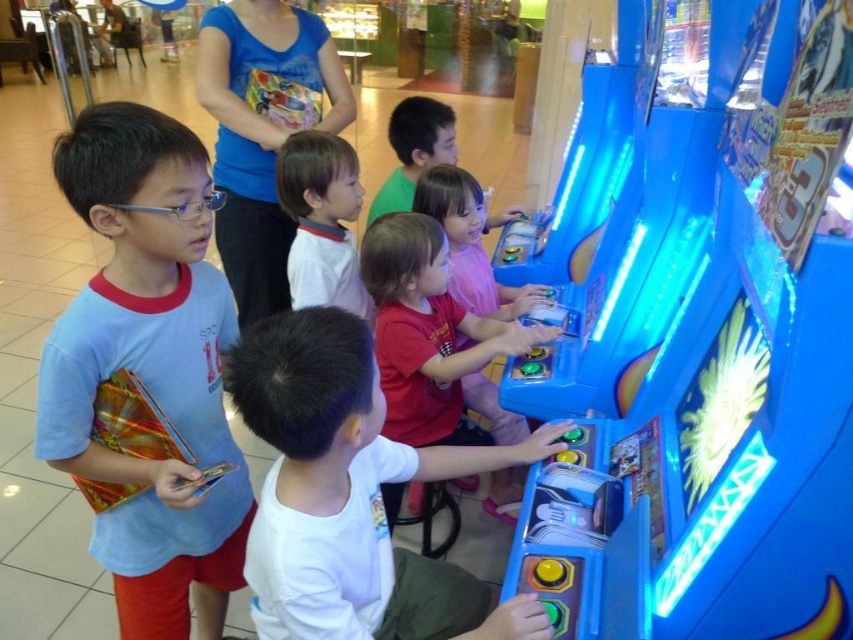
Does light blue cotton shirt at left appear over white matte shirt at center?

Incorrect, light blue cotton shirt at left is not positioned above white matte shirt at center.

Is point (132, 296) positioned before point (506, 605)?

No, it is not.

Is point (136, 376) positioned before point (404, 468)?

Yes.

The height and width of the screenshot is (640, 853). Identify the location of light blue cotton shirt at left. (148, 374).

Is point (413, 451) positioned after point (357, 193)?

That is False.

Can you confirm if white matte shirt at center is smaller than smooth white shirt at center?

Incorrect, white matte shirt at center is not smaller in size than smooth white shirt at center.

Is point (404, 618) farther from viewer compared to point (299, 266)?

No, it is not.

Find the location of a particular element. white matte shirt at center is located at coordinates (351, 493).

Can you confirm if light blue cotton shirt at left is positioned below smooth white shirt at center?

Yes, light blue cotton shirt at left is below smooth white shirt at center.

Does light blue cotton shirt at left have a greater height compared to smooth white shirt at center?

Yes, light blue cotton shirt at left is taller than smooth white shirt at center.

Who is more forward, (166, 532) or (346, 296)?

Positioned in front is point (166, 532).

Find the location of a particular element. light blue cotton shirt at left is located at coordinates (148, 374).